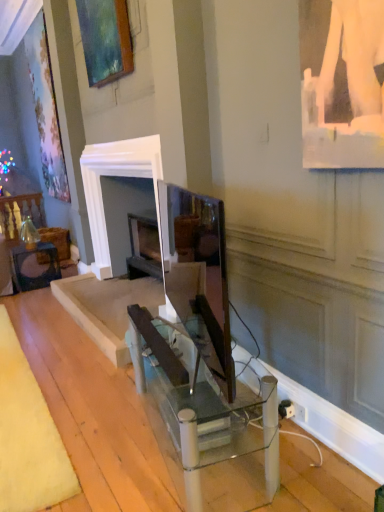
Question: Is matte glass table at lower left, arranged as the 2th table when viewed from the front, directly adjacent to matte wooden picture frame at upper left?

Choices:
 (A) yes
 (B) no

Answer: (B)

Question: From a real-world perspective, is matte glass table at lower left, which is the 1th table from back to front, on matte wooden picture frame at upper left?

Choices:
 (A) yes
 (B) no

Answer: (B)

Question: Is matte glass table at lower left, which is the 1th table from back to front, to the left of matte wooden picture frame at upper left from the viewer's perspective?

Choices:
 (A) no
 (B) yes

Answer: (B)

Question: From the image's perspective, does matte glass table at lower left, acting as the 1th table starting from the left, appear higher than matte wooden picture frame at upper left?

Choices:
 (A) yes
 (B) no

Answer: (B)

Question: Does matte glass table at lower left, arranged as the 2th table when viewed from the front, lie behind matte wooden picture frame at upper left?

Choices:
 (A) no
 (B) yes

Answer: (B)

Question: Considering the relative sizes of matte glass table at lower left, which ranks as the second table in bottom-to-top order, and matte wooden picture frame at upper left in the image provided, is matte glass table at lower left, which ranks as the second table in bottom-to-top order, thinner than matte wooden picture frame at upper left?

Choices:
 (A) yes
 (B) no

Answer: (B)

Question: Would you say matte black monitor at center contains matte glass table at lower left, which ranks as the second table in bottom-to-top order?

Choices:
 (A) yes
 (B) no

Answer: (B)

Question: From a real-world perspective, is matte black monitor at center positioned over matte glass table at lower left, the 2th table from the right, based on gravity?

Choices:
 (A) no
 (B) yes

Answer: (B)

Question: Is matte black monitor at center closer to camera compared to matte glass table at lower left, arranged as the 2th table when viewed from the front?

Choices:
 (A) yes
 (B) no

Answer: (A)

Question: Is matte black monitor at center positioned beyond the bounds of matte glass table at lower left, acting as the 1th table starting from the left?

Choices:
 (A) yes
 (B) no

Answer: (A)

Question: From the image's perspective, does matte black monitor at center appear lower than matte glass table at lower left, which is the 1th table from back to front?

Choices:
 (A) yes
 (B) no

Answer: (B)

Question: Is matte black monitor at center thinner than matte glass table at lower left, acting as the 1th table starting from the left?

Choices:
 (A) no
 (B) yes

Answer: (B)

Question: From a real-world perspective, is matte glass table at lower left, acting as the 1th table starting from the left, physically above clear glass table at center, the second table when ordered from left to right?

Choices:
 (A) no
 (B) yes

Answer: (A)